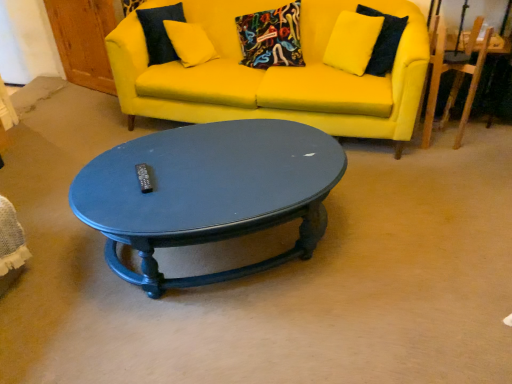
The width and height of the screenshot is (512, 384). Describe the element at coordinates (208, 192) in the screenshot. I see `glossy dark blue coffee table at center` at that location.

At what (x,y) coordinates should I click in order to perform the action: click on matte yellow fabric couch at upper center. Please return your answer as a coordinate pair (x, y). Image resolution: width=512 pixels, height=384 pixels. Looking at the image, I should click on (274, 74).

Can you confirm if glossy dark blue coffee table at center is wider than wooden armchair at right?

Yes.

Between point (322, 147) and point (436, 31), which one is positioned behind?

Point (436, 31)

Where is `coffee table in front of the wooden armchair at right`? Image resolution: width=512 pixels, height=384 pixels. coffee table in front of the wooden armchair at right is located at coordinates (208, 192).

The width and height of the screenshot is (512, 384). I want to click on studio couch above the wooden armchair at right (from the image's perspective), so click(274, 74).

How different are the orientations of matte yellow fabric couch at upper center and wooden armchair at right in degrees?

There is a 9.26-degree angle between the facing directions of matte yellow fabric couch at upper center and wooden armchair at right.

Considering the positions of objects matte yellow fabric couch at upper center and wooden armchair at right in the image provided, who is behind, matte yellow fabric couch at upper center or wooden armchair at right?

wooden armchair at right is further from the camera.

Based on the photo, between matte yellow fabric couch at upper center and glossy dark blue coffee table at center, which one has more height?

matte yellow fabric couch at upper center.

From the picture: Considering their positions, is matte yellow fabric couch at upper center located in front of or behind glossy dark blue coffee table at center?

matte yellow fabric couch at upper center is behind glossy dark blue coffee table at center.

How many degrees apart are the facing directions of matte yellow fabric couch at upper center and glossy dark blue coffee table at center?

They differ by 32.2 degrees in their facing directions.

Is matte yellow fabric couch at upper center directly adjacent to glossy dark blue coffee table at center?

No, matte yellow fabric couch at upper center is not with glossy dark blue coffee table at center.

Do you think wooden armchair at right is within glossy dark blue coffee table at center, or outside of it?

wooden armchair at right exists outside the volume of glossy dark blue coffee table at center.

Could you tell me if wooden armchair at right is facing glossy dark blue coffee table at center?

No, wooden armchair at right is not turned towards glossy dark blue coffee table at center.

How much distance is there between wooden armchair at right and glossy dark blue coffee table at center?

wooden armchair at right is 5.03 feet from glossy dark blue coffee table at center.

How much distance is there between wooden armchair at right and matte yellow fabric couch at upper center?

wooden armchair at right is 34.00 inches away from matte yellow fabric couch at upper center.

Looking at this image, is wooden armchair at right inside or outside of matte yellow fabric couch at upper center?

wooden armchair at right is spatially situated outside matte yellow fabric couch at upper center.

Is wooden armchair at right shorter than matte yellow fabric couch at upper center?

Indeed, wooden armchair at right has a lesser height compared to matte yellow fabric couch at upper center.

Is wooden armchair at right next to matte yellow fabric couch at upper center?

There is a gap between wooden armchair at right and matte yellow fabric couch at upper center.

Does glossy dark blue coffee table at center have a lesser width compared to matte yellow fabric couch at upper center?

Correct, the width of glossy dark blue coffee table at center is less than that of matte yellow fabric couch at upper center.

Which object is closer to the camera, glossy dark blue coffee table at center or matte yellow fabric couch at upper center?

glossy dark blue coffee table at center is in front.

Image resolution: width=512 pixels, height=384 pixels. In order to click on coffee table located in front of the matte yellow fabric couch at upper center in this screenshot , I will do `click(208, 192)`.

From the image's perspective, is glossy dark blue coffee table at center positioned above or below matte yellow fabric couch at upper center?

From the image's perspective, glossy dark blue coffee table at center appears below matte yellow fabric couch at upper center.

Locate an element on the screen. This screenshot has width=512, height=384. armchair on the right side of glossy dark blue coffee table at center is located at coordinates (453, 82).

Identify the location of studio couch that appears below the wooden armchair at right (from a real-world perspective). This screenshot has width=512, height=384. (274, 74).

Based on their spatial positions, is wooden armchair at right or glossy dark blue coffee table at center closer to matte yellow fabric couch at upper center?

The object closer to matte yellow fabric couch at upper center is wooden armchair at right.

Which object lies further to the anchor point matte yellow fabric couch at upper center, glossy dark blue coffee table at center or wooden armchair at right?

glossy dark blue coffee table at center is further to matte yellow fabric couch at upper center.

When comparing their distances from glossy dark blue coffee table at center, does wooden armchair at right or matte yellow fabric couch at upper center seem closer?

The object closer to glossy dark blue coffee table at center is matte yellow fabric couch at upper center.

Looking at the image, which one is located further to wooden armchair at right, glossy dark blue coffee table at center or matte yellow fabric couch at upper center?

Based on the image, glossy dark blue coffee table at center appears to be further to wooden armchair at right.

Looking at the image, which one is located closer to glossy dark blue coffee table at center, matte yellow fabric couch at upper center or wooden armchair at right?

matte yellow fabric couch at upper center lies closer to glossy dark blue coffee table at center than the other object.

Looking at the image, which one is located closer to wooden armchair at right, matte yellow fabric couch at upper center or glossy dark blue coffee table at center?

matte yellow fabric couch at upper center is closer to wooden armchair at right.

What are the coordinates of `studio couch between glossy dark blue coffee table at center and wooden armchair at right` in the screenshot? It's located at (274, 74).